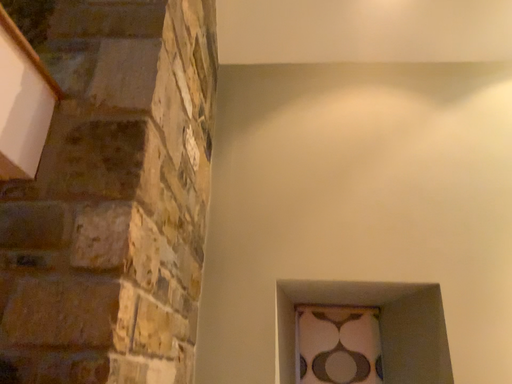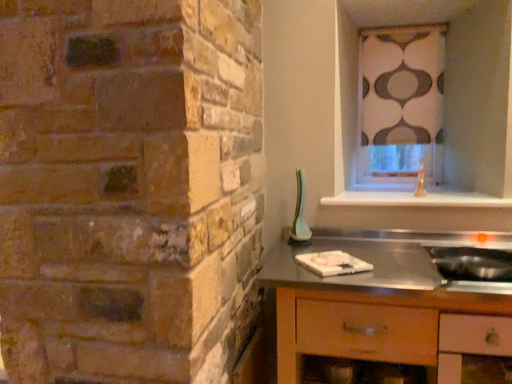
Question: How did the camera likely rotate when shooting the video?

Choices:
 (A) rotated left
 (B) rotated right

Answer: (A)